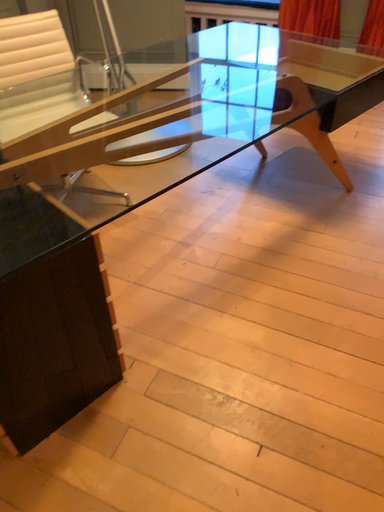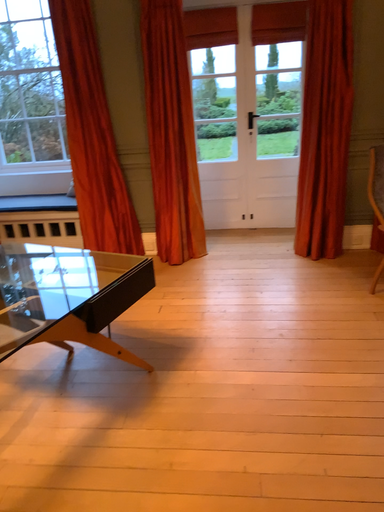
Question: Which way did the camera rotate in the video?

Choices:
 (A) rotated downward
 (B) rotated upward

Answer: (B)